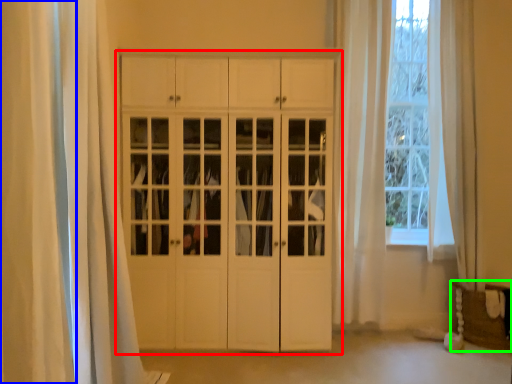
Question: Based on their relative distances, which object is farther from cupboard (highlighted by a red box)? Choose from curtain (highlighted by a blue box) and furniture (highlighted by a green box).

Choices:
 (A) curtain
 (B) furniture

Answer: (B)